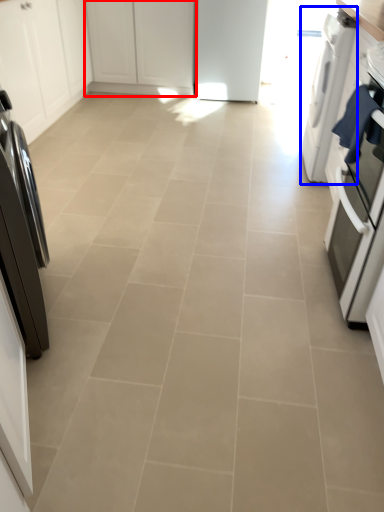
Question: Among these objects, which one is nearest to the camera, cabinetry (highlighted by a red box) or home appliance (highlighted by a blue box)?

Choices:
 (A) cabinetry
 (B) home appliance

Answer: (B)